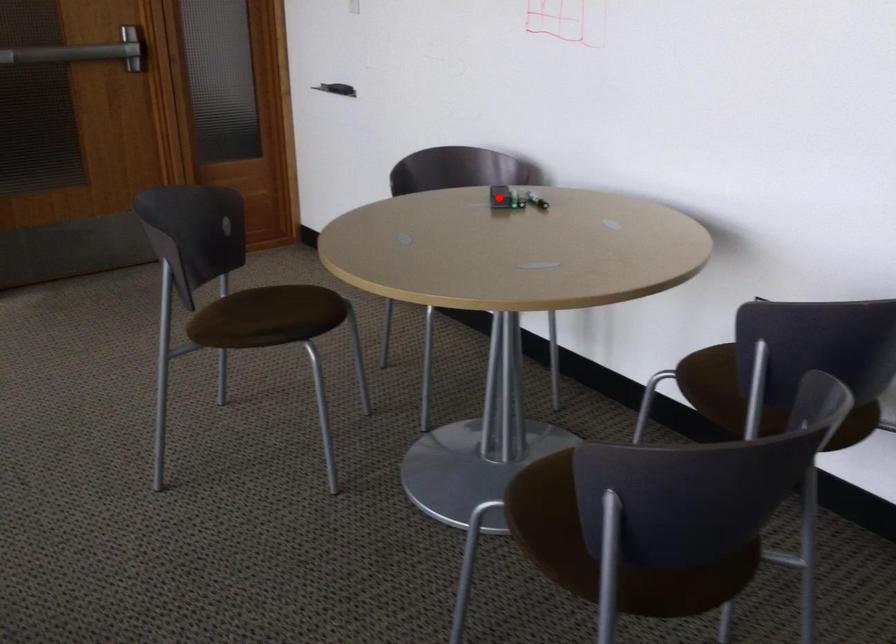
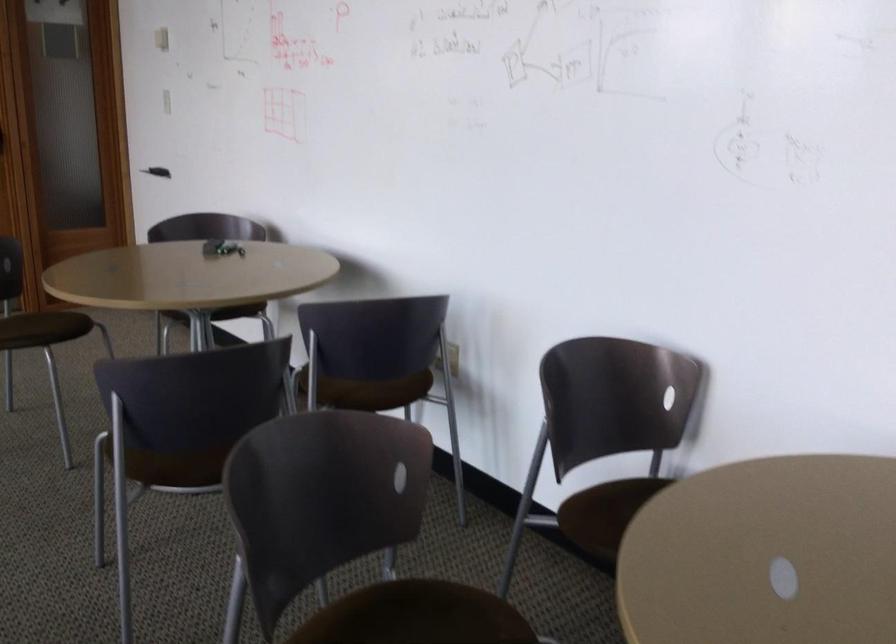
Question: I am providing you with two images of the same scene from different viewpoints. A red point is marked on the first image. At the location where the point appears in image 1, is it still visible in image 2?

Choices:
 (A) Yes
 (B) No

Answer: (B)